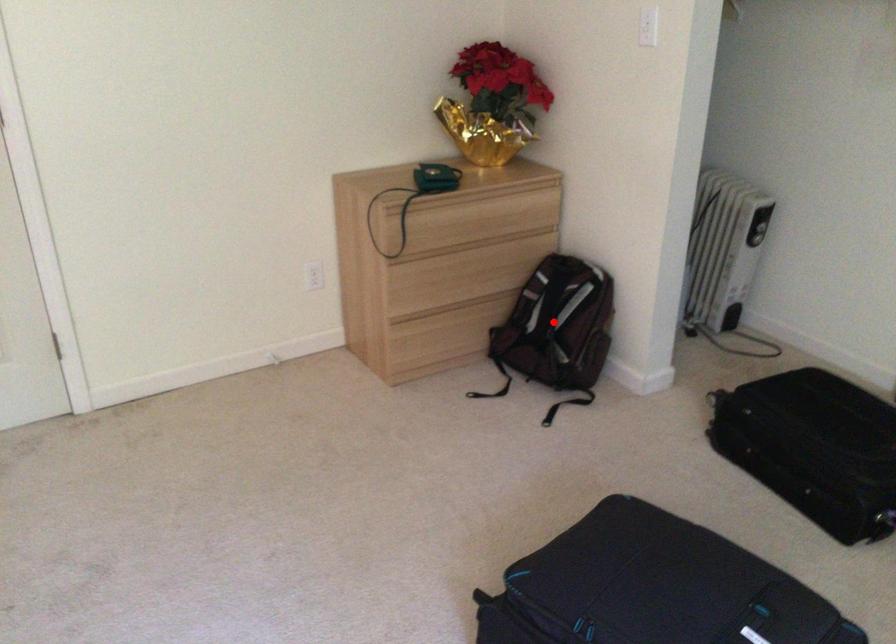
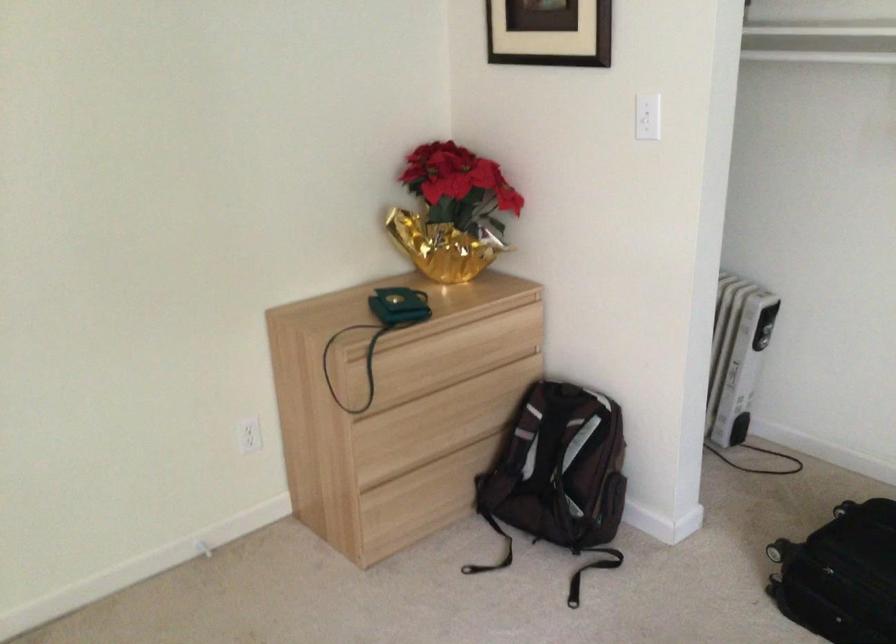
Question: I am providing you with two images of the same scene from different viewpoints. A red point is marked on the first image. Is the red point's position out of view in image 2?

Choices:
 (A) Yes
 (B) No

Answer: (B)